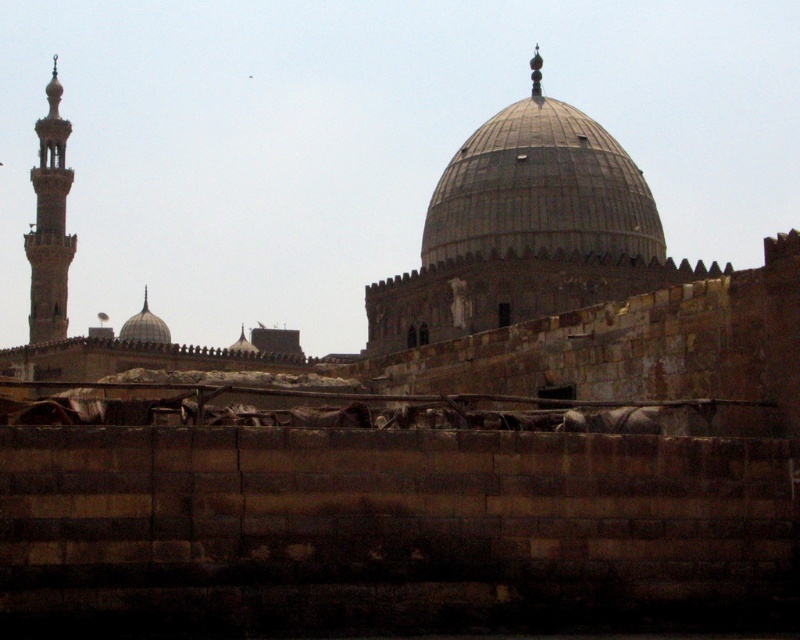
You are standing in front of the historical mosque scene. You notice the gray stone dome at center and the smooth stone minaret at left. Which of these two objects is positioned lower in the image?

The gray stone dome at center is positioned lower than the smooth stone minaret at left in the image.

You are standing at the point with coordinates point at (540, 188) in this historical architectural scene. What object are you directly facing?

The point at (540, 188) corresponds to the gray stone dome at center, so you are directly facing the gray stone dome at center.

You are standing in front of the historical mosque scene. There are two points marked in the image. The first point is at coordinates point (504, 188) and the second is at point (52, 337). Which of these two points is closer to you?

Point (504, 188) is closer to the viewer than point (52, 337).